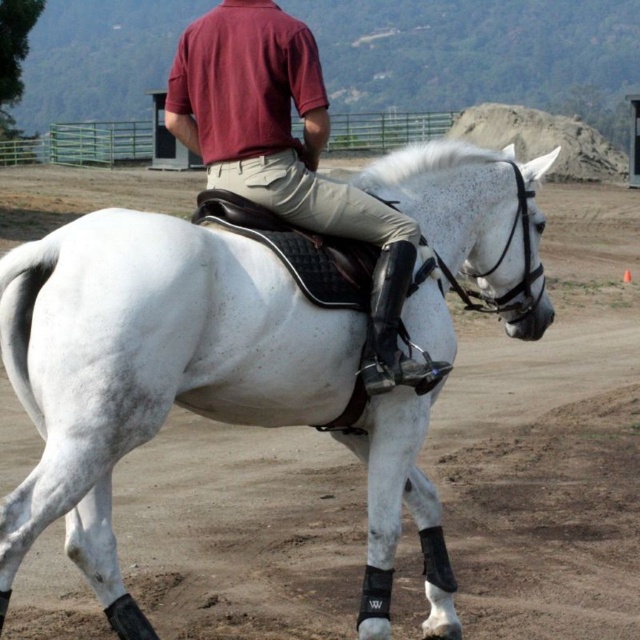
You are standing in the arena and want to know how far the point at coordinates (65, 404) is from you. Can you determine the distance?

The point at coordinates (65, 404) is 3.80 meters away from you.